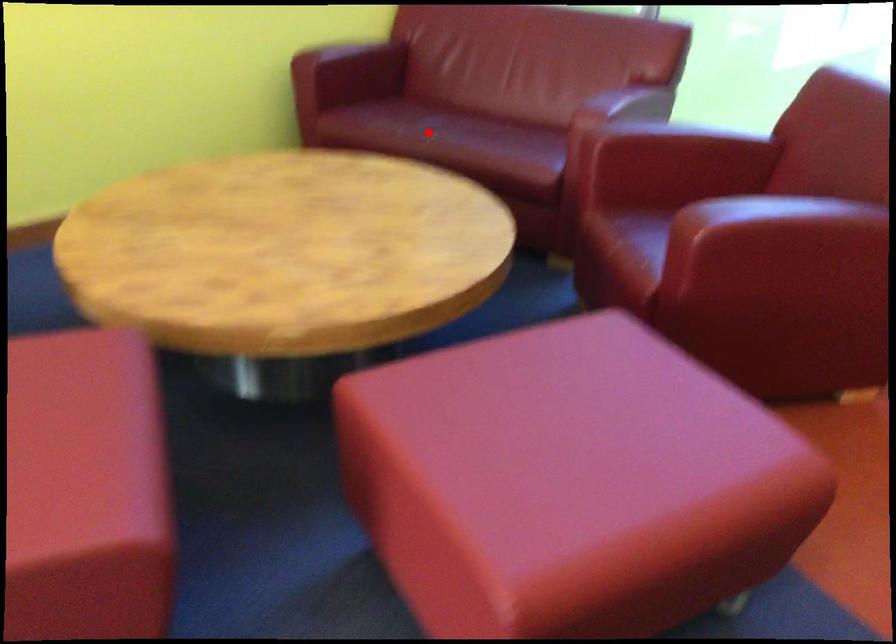
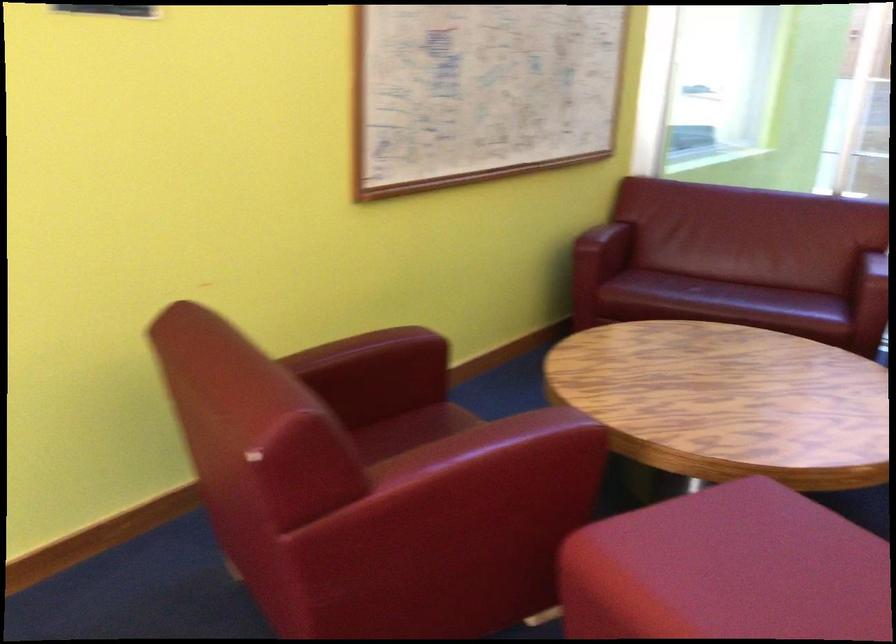
Question: I am providing you with two images of the same scene from different viewpoints. A red point is marked on the first image. Can you still see the location of the red point in image 2?

Choices:
 (A) Yes
 (B) No

Answer: (A)